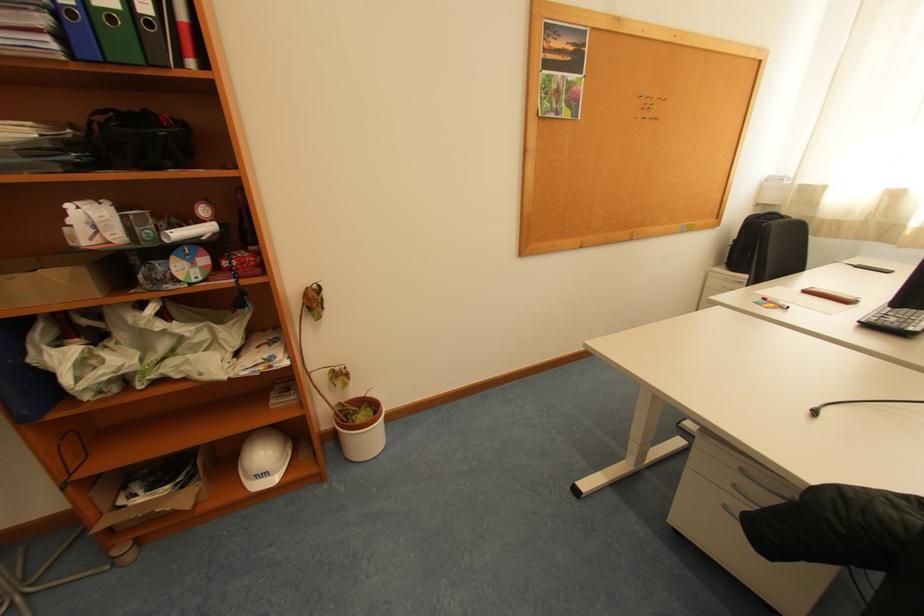
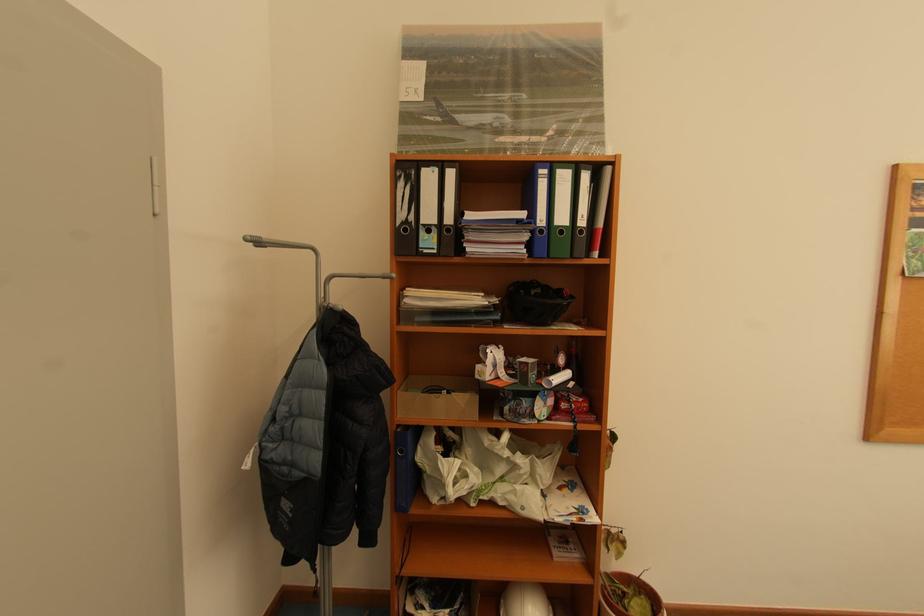
Locate, in the second image, the point that corresponds to [348,405] in the first image.

(614, 576)